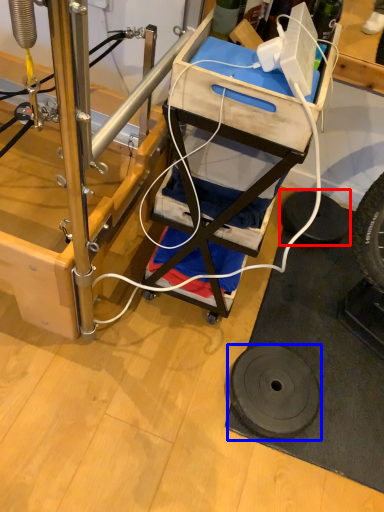
Question: Which of the following is the closest to the observer, tire (highlighted by a red box) or wheel (highlighted by a blue box)?

Choices:
 (A) tire
 (B) wheel

Answer: (B)